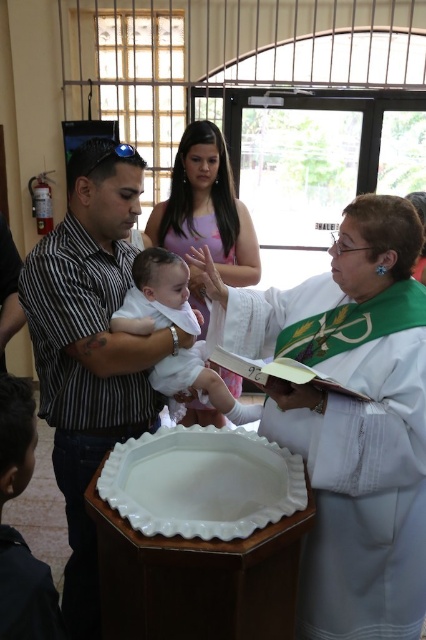
You are a photographer setting up for a baptismal ceremony. You need to place a decorative arrangement on the white glossy tray at center so it doesn not block the dark blue fabric at lower left. Where should you position the arrangement on the tray?

The white glossy tray at center is positioned on the right side of the dark blue fabric at lower left. To avoid blocking the dark blue fabric at lower left, place the decorative arrangement on the left side of the white glossy tray at center, closer to the dark blue fabric at lower left.